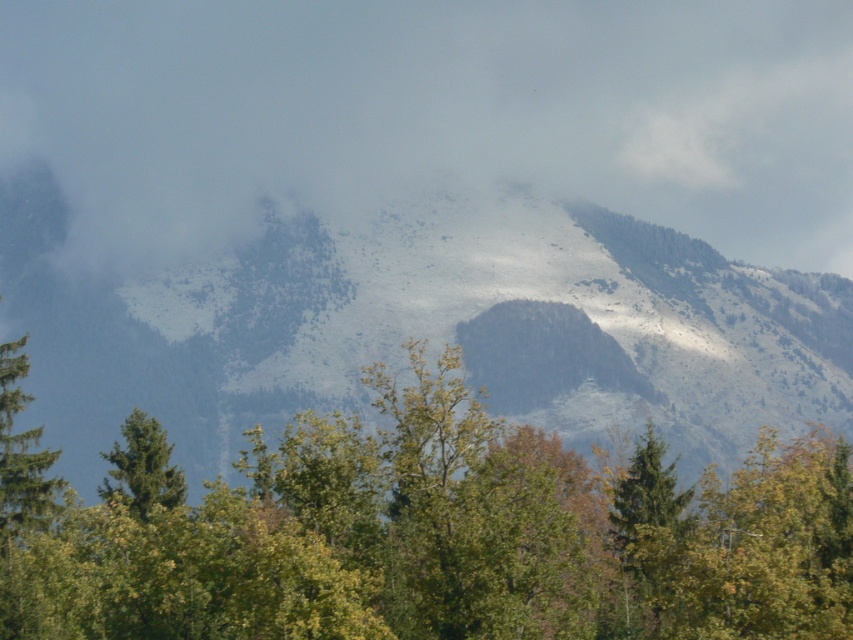
You are planning to hike from the green matte tree at left to the base of the snowy rocky mountain at upper center. Considering the size difference between them, which object would you encounter first when starting your hike?

You will first encounter the green matte tree at left because it is closer to the starting point and much shorter than the snowy rocky mountain at upper center, which is taller and likely farther away.

You are standing in the mountainous landscape and want to move from the point at coordinates point (177, 180) to the point at coordinates point (27, 524). Which direction should you face to walk towards the second point?

Point (177, 180) is further to the viewer than point (27, 524), so you should face downwards to walk towards the second point.

You are a weather drone tasked with capturing cloud formations. You need to fly to the white fluffy cloud at upper center. According to the coordinates provided, where should you navigate to?

The white fluffy cloud at upper center is located at point (434, 115), so you should navigate to those coordinates to reach it.